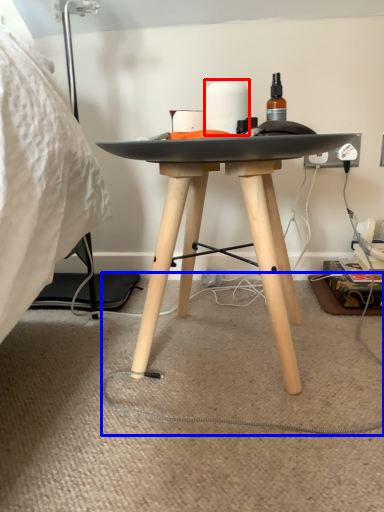
Question: Which point is closer to the camera, toilet paper (highlighted by a red box) or string (highlighted by a blue box)?

Choices:
 (A) toilet paper
 (B) string

Answer: (B)